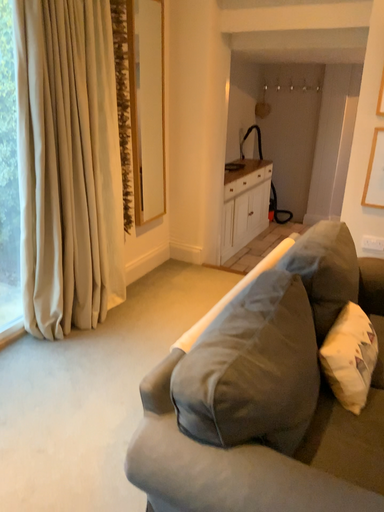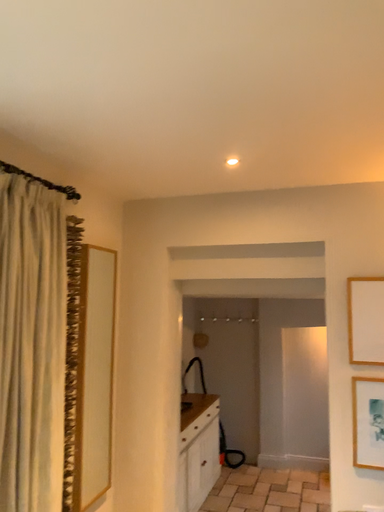
Question: How did the camera likely rotate when shooting the video?

Choices:
 (A) rotated upward
 (B) rotated downward

Answer: (A)